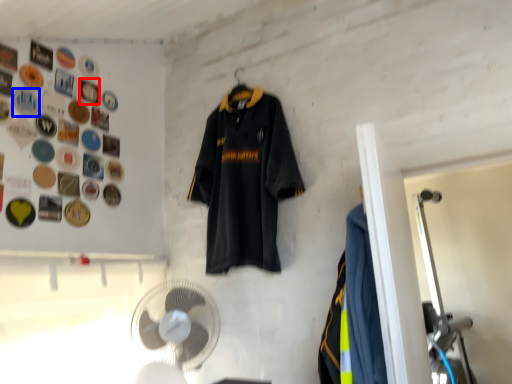
Question: Which object appears closest to the camera in this image, button (highlighted by a red box) or button (highlighted by a blue box)?

Choices:
 (A) button
 (B) button

Answer: (B)